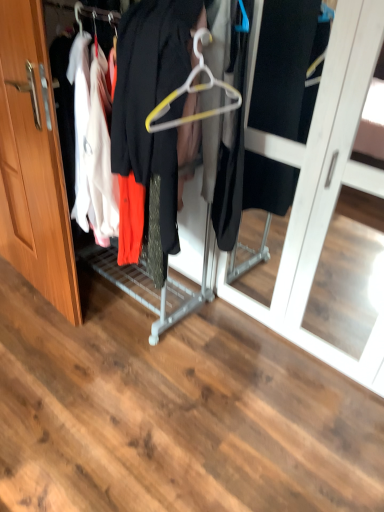
Find the location of a particular element. The height and width of the screenshot is (512, 384). unoccupied region to the right of wooden door at left is located at coordinates (113, 312).